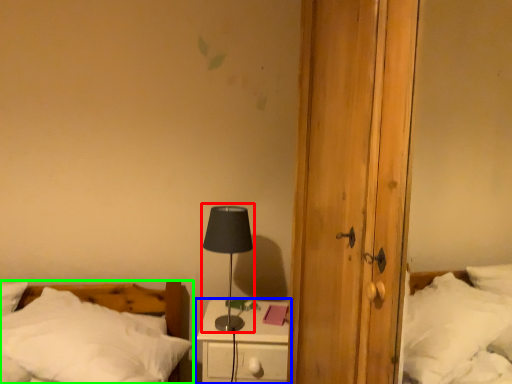
Question: Based on their relative distances, which object is farther from table lamp (highlighted by a red box)? Choose from nightstand (highlighted by a blue box) and bed (highlighted by a green box).

Choices:
 (A) nightstand
 (B) bed

Answer: (B)